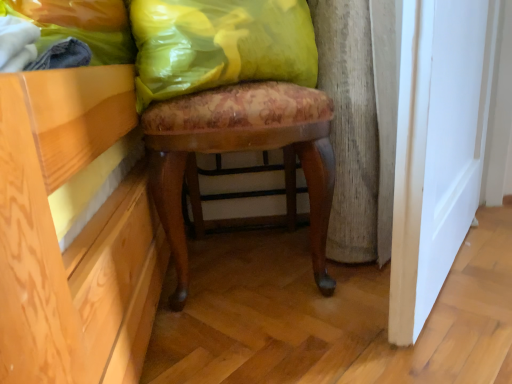
The width and height of the screenshot is (512, 384). Describe the element at coordinates (220, 45) in the screenshot. I see `yellow fabric pillow at upper center` at that location.

Identify the location of floral fabric stool at center. This screenshot has width=512, height=384. click(240, 150).

The height and width of the screenshot is (384, 512). I want to click on yellow plastic bag at upper left, so click(76, 31).

Considering the relative sizes of floral fabric stool at center and yellow plastic bag at upper left in the image provided, is floral fabric stool at center wider than yellow plastic bag at upper left?

Yes, floral fabric stool at center is wider than yellow plastic bag at upper left.

Which of these two, floral fabric stool at center or yellow plastic bag at upper left, stands shorter?

With less height is yellow plastic bag at upper left.

In the scene shown: Relative to yellow plastic bag at upper left, is floral fabric stool at center in front or behind?

In the image, floral fabric stool at center appears behind yellow plastic bag at upper left.

Is floral fabric stool at center outside of yellow plastic bag at upper left?

Yes, floral fabric stool at center is located beyond the bounds of yellow plastic bag at upper left.

Is yellow plastic bag at upper left at the back of yellow fabric pillow at upper center?

No, yellow fabric pillow at upper center is not facing away from yellow plastic bag at upper left.

Is yellow fabric pillow at upper center inside or outside of yellow plastic bag at upper left?

yellow fabric pillow at upper center is located beyond the bounds of yellow plastic bag at upper left.

From their relative heights in the image, would you say yellow fabric pillow at upper center is taller or shorter than yellow plastic bag at upper left?

yellow fabric pillow at upper center is shorter than yellow plastic bag at upper left.

Which point is more forward, (188, 16) or (121, 13)?

The point (188, 16) is closer to the camera.

From a real-world perspective, is yellow fabric pillow at upper center on floral fabric stool at center?

Correct, in the physical world, yellow fabric pillow at upper center is higher than floral fabric stool at center.

Identify the location of throw pillow lying on the left of floral fabric stool at center. (220, 45).

Is yellow fabric pillow at upper center facing away from floral fabric stool at center?

Yes, yellow fabric pillow at upper center is positioned with its back facing floral fabric stool at center.

Considering the relative sizes of yellow fabric pillow at upper center and floral fabric stool at center in the image provided, is yellow fabric pillow at upper center thinner than floral fabric stool at center?

Correct, the width of yellow fabric pillow at upper center is less than that of floral fabric stool at center.

Does yellow plastic bag at upper left touch yellow fabric pillow at upper center?

Answer: No, yellow plastic bag at upper left is not making contact with yellow fabric pillow at upper center.

Can you confirm if yellow plastic bag at upper left is thinner than yellow fabric pillow at upper center?

Yes, yellow plastic bag at upper left is thinner than yellow fabric pillow at upper center.

Is point (65, 51) closer to viewer compared to point (265, 37)?

Yes, point (65, 51) is closer to viewer.

How many degrees apart are the facing directions of yellow plastic bag at upper left and yellow fabric pillow at upper center?

The angle between the facing direction of yellow plastic bag at upper left and the facing direction of yellow fabric pillow at upper center is 76.1 degrees.

Considering the relative positions of floral fabric stool at center and yellow fabric pillow at upper center in the image provided, is floral fabric stool at center to the right of yellow fabric pillow at upper center from the viewer's perspective?

Indeed, floral fabric stool at center is positioned on the right side of yellow fabric pillow at upper center.

Can you confirm if floral fabric stool at center is bigger than yellow fabric pillow at upper center?

Yes.

Does floral fabric stool at center touch yellow fabric pillow at upper center?

floral fabric stool at center and yellow fabric pillow at upper center are clearly separated.

How distant is yellow plastic bag at upper left from floral fabric stool at center?

30.13 centimeters.

Is yellow plastic bag at upper left beside floral fabric stool at center?

No, yellow plastic bag at upper left is not in contact with floral fabric stool at center.

From the image's perspective, between yellow plastic bag at upper left and floral fabric stool at center, who is located below?

From the image's view, floral fabric stool at center is below.

Could you tell me if yellow plastic bag at upper left is facing floral fabric stool at center?

No, yellow plastic bag at upper left does not turn towards floral fabric stool at center.

Locate an element on the screen. fabric located above the floral fabric stool at center (from the image's perspective) is located at coordinates (76, 31).

At what (x,y) coordinates should I click in order to perform the action: click on fabric above the yellow fabric pillow at upper center (from a real-world perspective). Please return your answer as a coordinate pair (x, y). Looking at the image, I should click on (76, 31).

Looking at the image, which one is located closer to yellow plastic bag at upper left, yellow fabric pillow at upper center or floral fabric stool at center?

The object closer to yellow plastic bag at upper left is yellow fabric pillow at upper center.

Looking at the image, which one is located closer to yellow fabric pillow at upper center, yellow plastic bag at upper left or floral fabric stool at center?

Among the two, floral fabric stool at center is located nearer to yellow fabric pillow at upper center.

Considering their positions, is floral fabric stool at center positioned further to yellow plastic bag at upper left than yellow fabric pillow at upper center?

The object further to yellow plastic bag at upper left is floral fabric stool at center.

Looking at the image, which one is located closer to yellow fabric pillow at upper center, floral fabric stool at center or yellow plastic bag at upper left?

Based on the image, floral fabric stool at center appears to be nearer to yellow fabric pillow at upper center.

Estimate the real-world distances between objects in this image. Which object is further from floral fabric stool at center, yellow plastic bag at upper left or yellow fabric pillow at upper center?

Based on the image, yellow plastic bag at upper left appears to be further to floral fabric stool at center.

Which object lies further to the anchor point floral fabric stool at center, yellow fabric pillow at upper center or yellow plastic bag at upper left?

yellow plastic bag at upper left is positioned further to the anchor floral fabric stool at center.

Locate an element on the screen. throw pillow between yellow plastic bag at upper left and floral fabric stool at center is located at coordinates (220, 45).